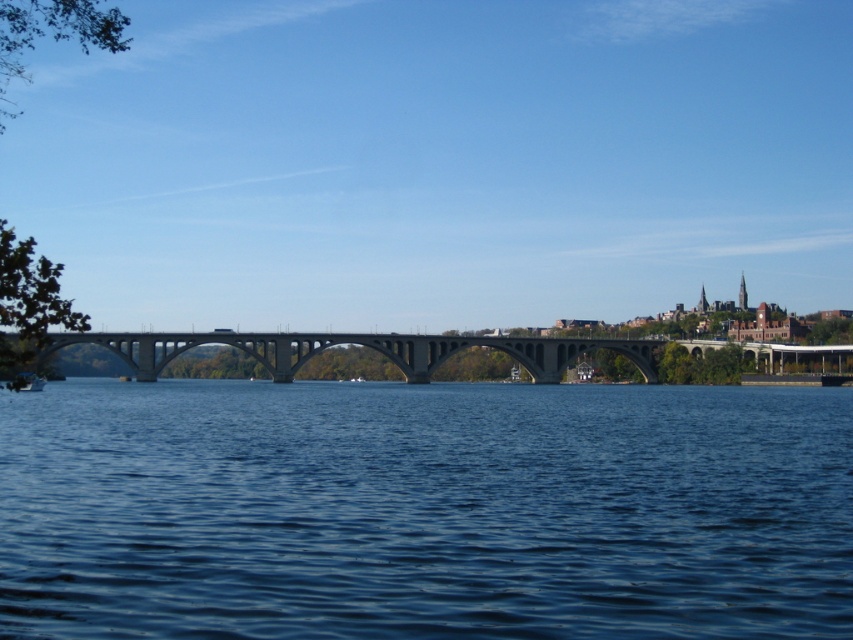
Question: Is blue water at center positioned behind concrete bridge at center?

Choices:
 (A) yes
 (B) no

Answer: (B)

Question: Which point is farther to the camera?

Choices:
 (A) (433, 364)
 (B) (587, 458)

Answer: (A)

Question: From the image, what is the correct spatial relationship of blue water at center in relation to concrete bridge at center?

Choices:
 (A) above
 (B) below

Answer: (B)

Question: Is blue water at center to the left of concrete bridge at center from the viewer's perspective?

Choices:
 (A) no
 (B) yes

Answer: (A)